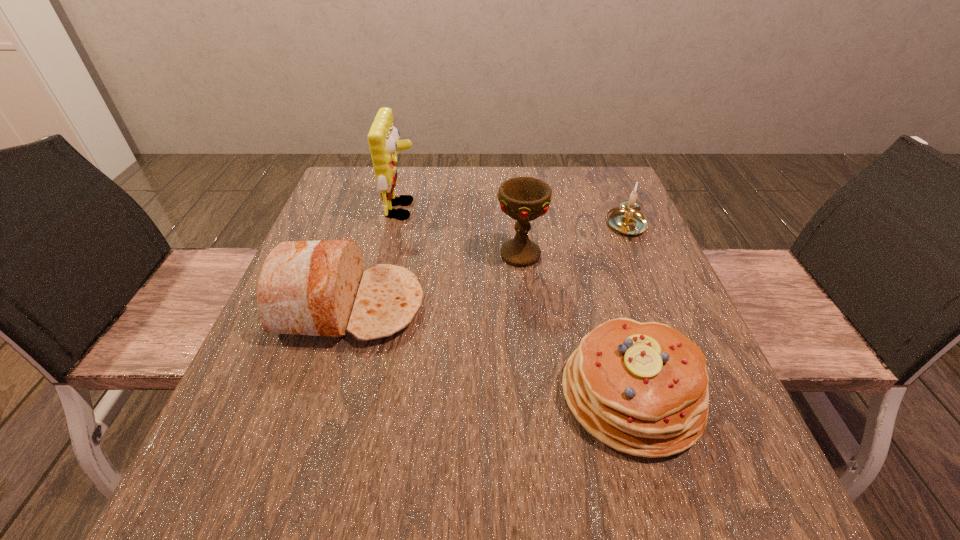
At what (x,y) coordinates should I click in order to perform the action: click on sponge. Please return your answer as a coordinate pair (x, y). Looking at the image, I should click on (383, 138).

Identify the location of the fourth shortest object. The height and width of the screenshot is (540, 960). (524, 199).

Identify the location of bread. (319, 288).

Where is `candle holder`? This screenshot has height=540, width=960. candle holder is located at coordinates (626, 219).

Locate an element on the screen. The width and height of the screenshot is (960, 540). pancake is located at coordinates [x=641, y=388].

You are a GUI agent. You are given a task and a screenshot of the screen. Output one action in this format:
    pyautogui.click(x=<x>, y=<y>)
    Task: Click on the vacant space positioned 0.100m on the face of the sponge
    
    Given the screenshot: What is the action you would take?
    pyautogui.click(x=457, y=210)

What are the coordinates of `free space located 0.280m on the front of the chalice` in the screenshot? It's located at (534, 377).

Where is `vacant region located 0.370m at the sliced end of the bread`? The width and height of the screenshot is (960, 540). vacant region located 0.370m at the sliced end of the bread is located at coordinates pyautogui.click(x=606, y=306).

Find the location of `free space located 0.380m on the handle side of the candle holder`. free space located 0.380m on the handle side of the candle holder is located at coordinates (691, 376).

This screenshot has height=540, width=960. In order to click on vacant space located on the left of the pancake in this screenshot , I will do `click(520, 394)`.